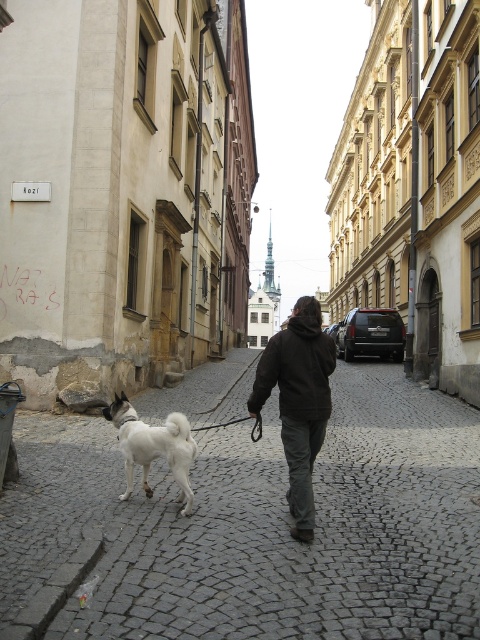
Question: Can you confirm if white fur dog at center is bigger than white fluffy dog at lower left?

Choices:
 (A) yes
 (B) no

Answer: (A)

Question: Does dark brown hoodie at center appear over white fluffy dog at lower left?

Choices:
 (A) no
 (B) yes

Answer: (B)

Question: Which point is closer to the camera taking this photo?

Choices:
 (A) click(303, 332)
 (B) click(85, 460)

Answer: (A)

Question: Is dark brown hoodie at center further to the viewer compared to white fluffy dog at lower left?

Choices:
 (A) yes
 (B) no

Answer: (B)

Question: Which of these objects is positioned farthest from the white fluffy dog at lower left?

Choices:
 (A) white fur dog at center
 (B) dark brown hoodie at center

Answer: (A)

Question: Which of these objects is positioned farthest from the white fluffy dog at lower left?

Choices:
 (A) white fur dog at center
 (B) dark brown hoodie at center

Answer: (A)